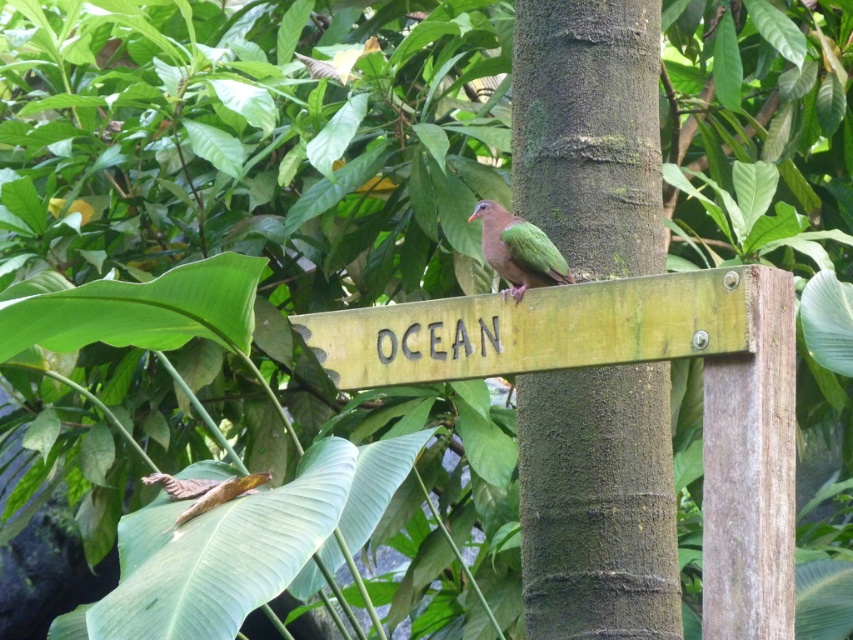
Who is lower down, green wood sign at center or green glossy bird at center?

green wood sign at center is lower down.

Between green wood sign at center and green glossy bird at center, which one appears on the right side from the viewer's perspective?

green glossy bird at center is more to the right.

Who is more forward, (628, 307) or (543, 280)?

Point (628, 307) is in front.

Where is `green wood sign at center`? green wood sign at center is located at coordinates (537, 330).

Is green rough bark at center to the left of green wood sign at center from the viewer's perspective?

In fact, green rough bark at center is to the right of green wood sign at center.

What are the coordinates of `green rough bark at center` in the screenshot? It's located at coord(596,504).

Who is taller, green rough bark at center or green glossy bird at center?

Standing taller between the two is green rough bark at center.

Can you confirm if green rough bark at center is wider than green glossy bird at center?

Indeed, green rough bark at center has a greater width compared to green glossy bird at center.

Locate an element on the screen. green rough bark at center is located at coordinates point(596,504).